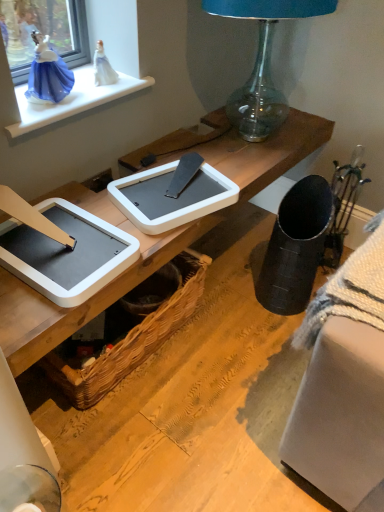
Question: Is point (81, 408) positioned closer to the camera than point (38, 109)?

Choices:
 (A) farther
 (B) closer

Answer: (A)

Question: In terms of height, does woven brown picnic basket at lower center look taller or shorter compared to white glossy window sill at upper left?

Choices:
 (A) short
 (B) tall

Answer: (B)

Question: Which of these objects is positioned farthest from the transparent glass lamp at upper center?

Choices:
 (A) woven brown picnic basket at lower center
 (B) white glossy window sill at upper left
 (C) white plastic tablet at center, the 1th tablet computer positioned from the right
 (D) white plastic tablet at center, acting as the first tablet computer starting from the left

Answer: (D)

Question: Which object is positioned closest to the woven brown picnic basket at lower center?

Choices:
 (A) white plastic tablet at center, acting as the first tablet computer starting from the left
 (B) transparent glass lamp at upper center
 (C) white plastic tablet at center, which is the second tablet computer in left-to-right order
 (D) white glossy window sill at upper left

Answer: (C)